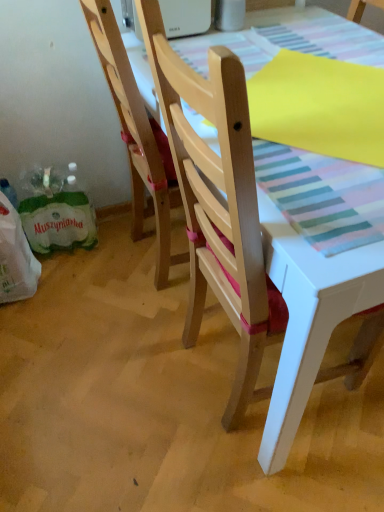
In order to click on vacant space in front of green plastic grocery bag at lower left in this screenshot , I will do `click(23, 320)`.